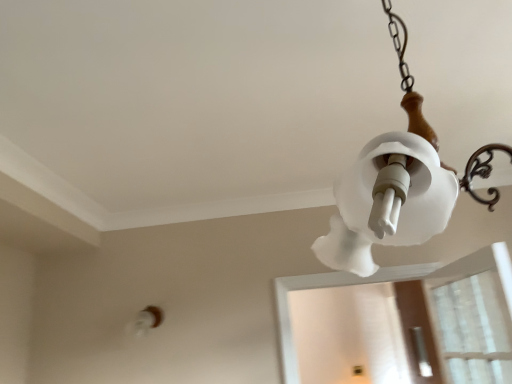
Question: Could you tell me if transparent plastic screen door at lower right is facing white frosted glass lampshade at upper right?

Choices:
 (A) yes
 (B) no

Answer: (B)

Question: Does transparent plastic screen door at lower right come in front of white frosted glass lampshade at upper right?

Choices:
 (A) yes
 (B) no

Answer: (B)

Question: From the image's perspective, is transparent plastic screen door at lower right located beneath white frosted glass lampshade at upper right?

Choices:
 (A) no
 (B) yes

Answer: (B)

Question: Is transparent plastic screen door at lower right in contact with white frosted glass lampshade at upper right?

Choices:
 (A) yes
 (B) no

Answer: (B)

Question: Would you say transparent plastic screen door at lower right contains white frosted glass lampshade at upper right?

Choices:
 (A) yes
 (B) no

Answer: (B)

Question: From the image's perspective, is transparent plastic screen door at lower right on white frosted glass lampshade at upper right?

Choices:
 (A) yes
 (B) no

Answer: (B)

Question: Is white frosted glass light fixture at lower left positioned in front of white frosted glass lampshade at upper right?

Choices:
 (A) yes
 (B) no

Answer: (B)

Question: From a real-world perspective, is white frosted glass light fixture at lower left positioned under white frosted glass lampshade at upper right based on gravity?

Choices:
 (A) no
 (B) yes

Answer: (B)

Question: Can you confirm if white frosted glass light fixture at lower left is bigger than white frosted glass lampshade at upper right?

Choices:
 (A) yes
 (B) no

Answer: (B)

Question: Is white frosted glass lampshade at upper right at the back of white frosted glass light fixture at lower left?

Choices:
 (A) no
 (B) yes

Answer: (A)

Question: Considering the relative positions of white frosted glass light fixture at lower left and white frosted glass lampshade at upper right in the image provided, is white frosted glass light fixture at lower left to the right of white frosted glass lampshade at upper right from the viewer's perspective?

Choices:
 (A) yes
 (B) no

Answer: (B)

Question: Is white frosted glass light fixture at lower left completely or partially outside of white frosted glass lampshade at upper right?

Choices:
 (A) no
 (B) yes

Answer: (B)

Question: Is white frosted glass lampshade at upper right behind transparent plastic screen door at lower right?

Choices:
 (A) no
 (B) yes

Answer: (A)